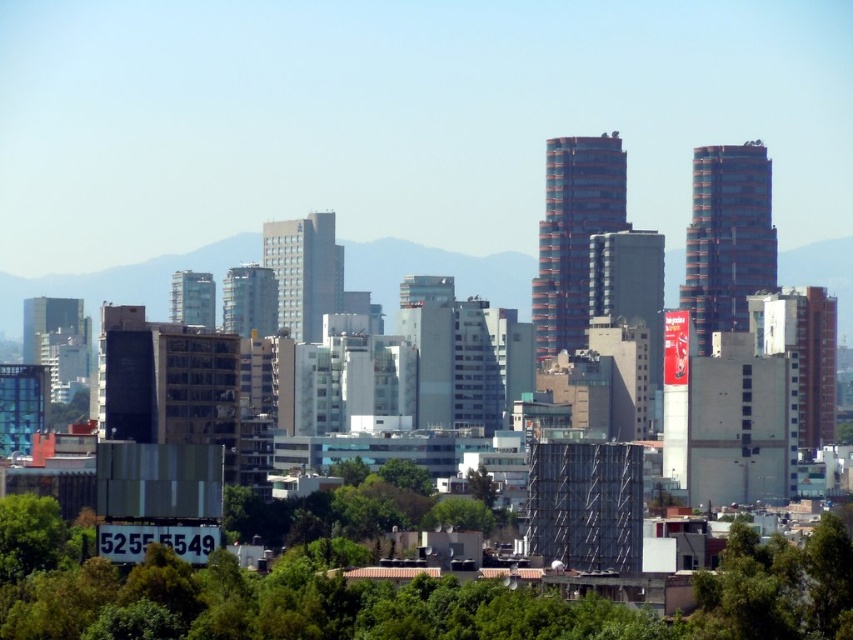
You are a drone operator trying to navigate between two green leafy trees in the cityscape. The trees are the green leafy tree at lower right and the green leafy tree at lower center. Which tree is positioned lower in the image?

The green leafy tree at lower right is located below the green leafy tree at lower center, so it is positioned lower in the image.

You are a bird looking for a nesting spot. You see the green leafy tree at lower right and the green leafy tree at lower center. Which tree is taller and would provide a better nesting spot?

The green leafy tree at lower right is taller than the green leafy tree at lower center, so it would provide a better nesting spot.